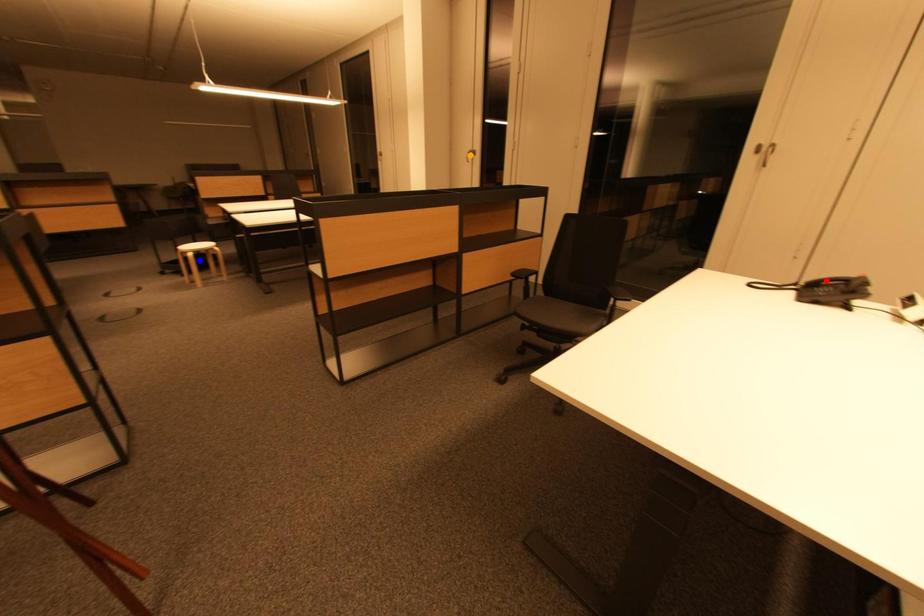
Order these from farthest to nearest:
1. orange point
2. blue point
3. red point

1. orange point
2. blue point
3. red point